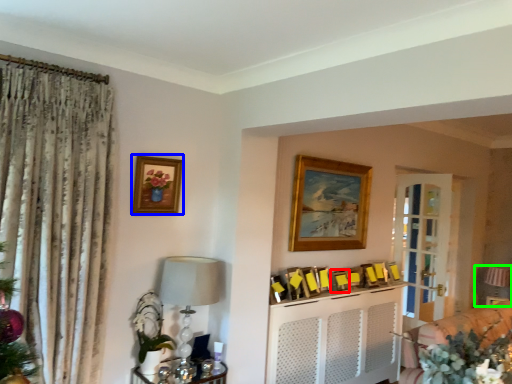
Question: Which object is the farthest from picture frame (highlighted by a red box)? Choose among these: picture frame (highlighted by a blue box) or furniture (highlighted by a green box).

Choices:
 (A) picture frame
 (B) furniture

Answer: (B)